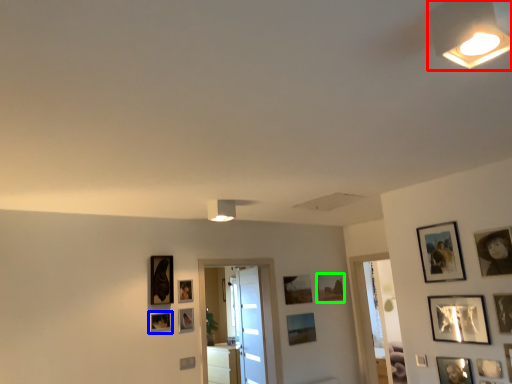
Question: Which object is the farthest from light fixture (highlighted by a red box)? Choose among these: picture frame (highlighted by a blue box) or picture frame (highlighted by a green box).

Choices:
 (A) picture frame
 (B) picture frame

Answer: (B)